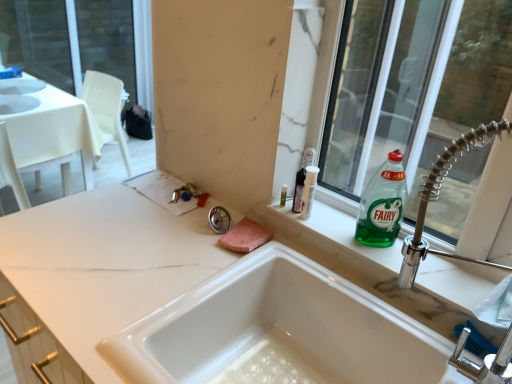
The width and height of the screenshot is (512, 384). Identify the location of empty space that is in between transparent glass window at upper right and green glass bottle at upper right. (373, 235).